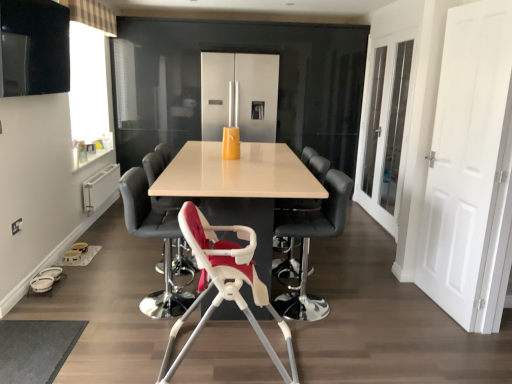
Question: Which direction should I rotate to face matte black chair at center, which appears as the fourth chair when viewed from the front, — up or down?

Choices:
 (A) up
 (B) down

Answer: (B)

Question: Would you say white plastic highchair at center, positioned as the 2th chair in front-to-back order, is a long distance from matte black chair at center, which appears as the fourth chair when viewed from the front?

Choices:
 (A) yes
 (B) no

Answer: (B)

Question: From a real-world perspective, is white plastic highchair at center, arranged as the fourth chair when viewed from the back, located higher than matte black chair at center, acting as the second chair starting from the back?

Choices:
 (A) yes
 (B) no

Answer: (B)

Question: Considering the relative sizes of white plastic highchair at center, arranged as the fourth chair when viewed from the back, and matte black chair at center, which appears as the fourth chair when viewed from the front, in the image provided, is white plastic highchair at center, arranged as the fourth chair when viewed from the back, wider than matte black chair at center, which appears as the fourth chair when viewed from the front,?

Choices:
 (A) no
 (B) yes

Answer: (B)

Question: Considering the relative positions of white plastic highchair at center, positioned as the 2th chair in front-to-back order, and matte black chair at center, which appears as the fourth chair when viewed from the front, in the image provided, is white plastic highchair at center, positioned as the 2th chair in front-to-back order, to the right of matte black chair at center, which appears as the fourth chair when viewed from the front, from the viewer's perspective?

Choices:
 (A) no
 (B) yes

Answer: (B)

Question: Can you confirm if white plastic highchair at center, positioned as the 2th chair in front-to-back order, is taller than matte black chair at center, which appears as the fourth chair when viewed from the front?

Choices:
 (A) yes
 (B) no

Answer: (B)

Question: Considering the relative sizes of white plastic highchair at center, positioned as the 2th chair in front-to-back order, and matte black chair at center, acting as the second chair starting from the back, in the image provided, is white plastic highchair at center, positioned as the 2th chair in front-to-back order, smaller than matte black chair at center, acting as the second chair starting from the back,?

Choices:
 (A) no
 (B) yes

Answer: (A)

Question: Does matte white table at center have a smaller size compared to white plastic highchair at center, the fifth chair when ordered from back to front?

Choices:
 (A) yes
 (B) no

Answer: (B)

Question: From the image's perspective, is matte white table at center beneath white plastic highchair at center, the fifth chair when ordered from back to front?

Choices:
 (A) no
 (B) yes

Answer: (A)

Question: Is matte white table at center turned away from white plastic highchair at center, placed as the first chair when sorted from front to back?

Choices:
 (A) no
 (B) yes

Answer: (A)

Question: From a real-world perspective, does matte white table at center stand above white plastic highchair at center, the fifth chair when ordered from back to front?

Choices:
 (A) yes
 (B) no

Answer: (A)

Question: Can you confirm if matte white table at center is positioned to the left of white plastic highchair at center, the fifth chair when ordered from back to front?

Choices:
 (A) no
 (B) yes

Answer: (B)

Question: Does matte white table at center have a lesser width compared to white plastic highchair at center, the fifth chair when ordered from back to front?

Choices:
 (A) no
 (B) yes

Answer: (A)

Question: Is black leather bar stool at center, which is the 3th chair from back to front, positioned behind white matte door at right?

Choices:
 (A) yes
 (B) no

Answer: (A)